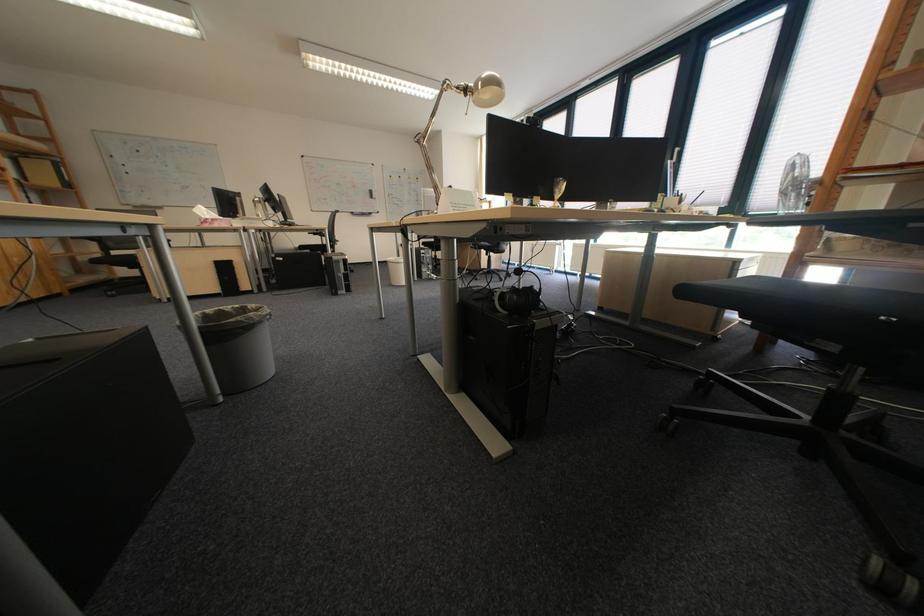
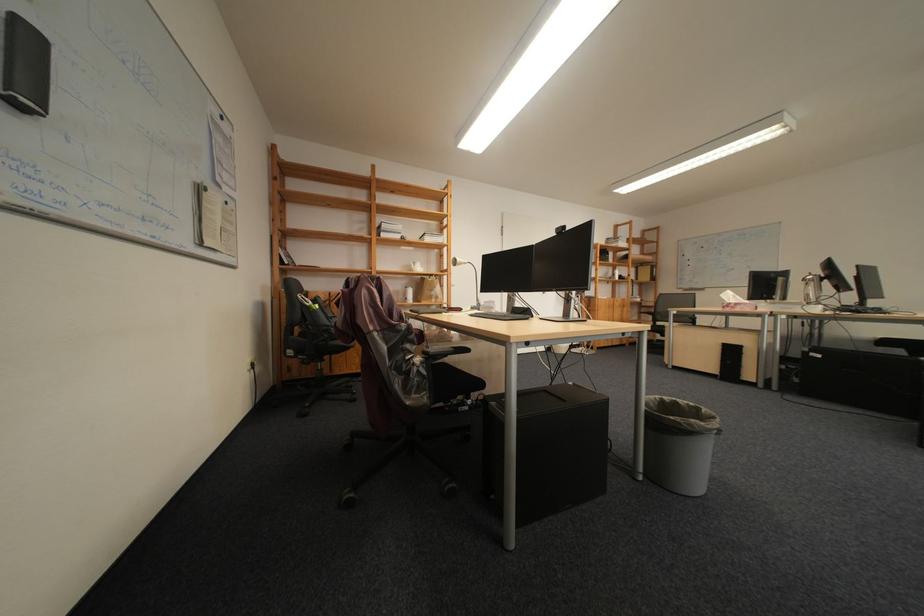
Question: The first image is from the beginning of the video and the second image is from the end. How did the camera likely rotate when shooting the video?

Choices:
 (A) Left
 (B) Right
 (C) Up
 (D) Down

Answer: (A)